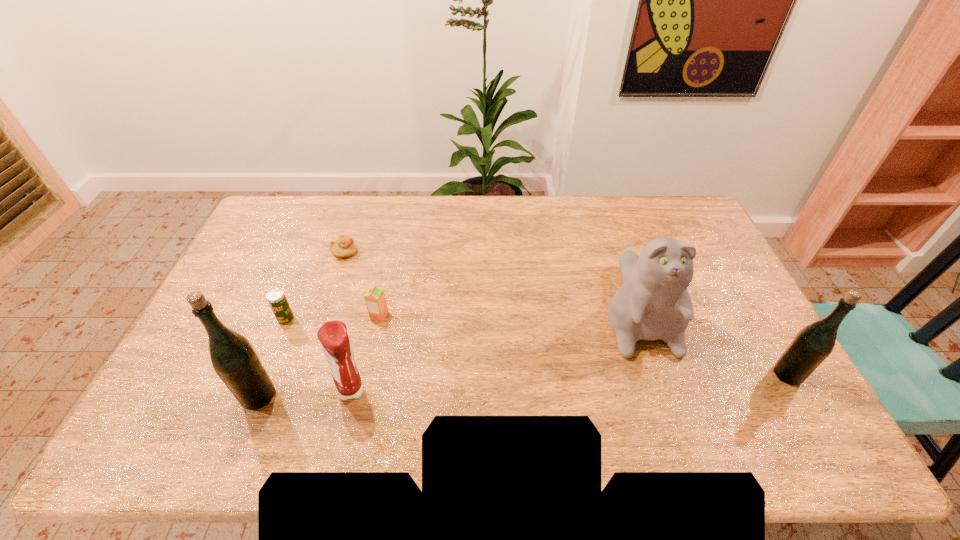
If equal spacing is desired by inserting an extra beer_bottle among them, please point out a free spot for this new beer_bottle. Please provide its 2D coordinates. Your answer should be formatted as a tuple, i.e. [(x, y)], where the tuple contains the x and y coordinates of a point satisfying the conditions above.

[(528, 384)]